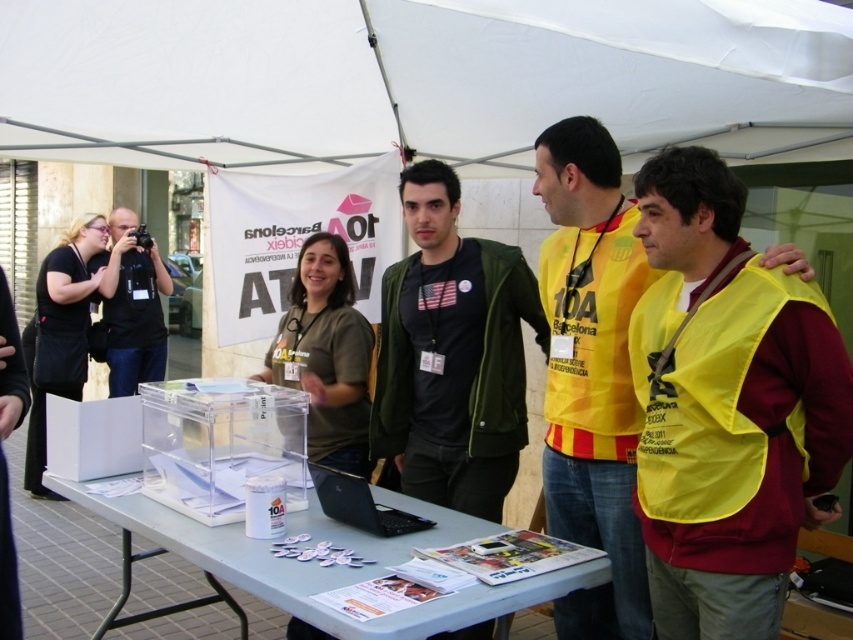
You are a photographer standing behind the table. You need to take a photo that includes both the dark green jacket at center and the black fabric apron at left. Which object should be placed closer to the camera to ensure both are fully visible in the frame?

The dark green jacket at center is shorter than the black fabric apron at left, so you should place the dark green jacket at center closer to the camera to ensure both are fully visible in the frame.

Based on the photo, you are a delivery person who needs to place a 10 feet long package between the dark green jacket at center and the black fabric apron at left. Can you fit it without moving either object?

The distance between the dark green jacket at center and the black fabric apron at left is 10.70 feet, so yes, the 10 feet long package can be placed between them without moving either object since there is enough space.

You are a photographer standing at the edge of the group. You want to take a photo that includes both the dark green jacket at center and the small container labeled 10A on the table. Given that your camera has a maximum focus range of 2.5 meters, will you be able to capture both subjects in focus?

The dark green jacket at center and the small container labeled 10A are 2.68 meters apart. Since the camera can only focus within 2.5 meters, the distance between them exceeds the focus range. Therefore, you won camera will not be able to capture both subjects in focus simultaneously.